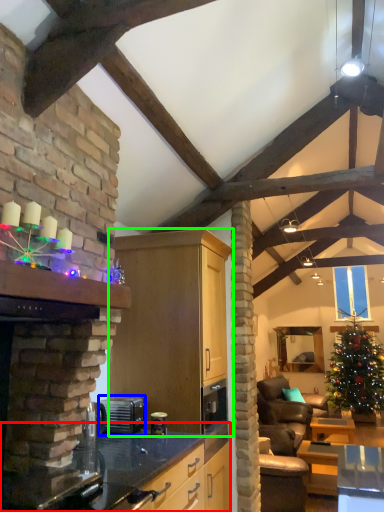
Question: Based on their relative distances, which object is nearer to countertop (highlighted by a red box)? Choose from appliance (highlighted by a blue box) and cabinetry (highlighted by a green box).

Choices:
 (A) appliance
 (B) cabinetry

Answer: (A)